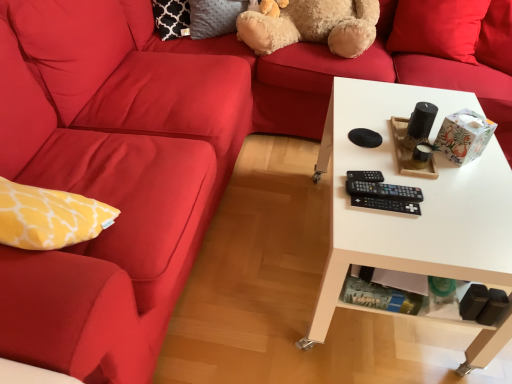
Where is `free space to the back side of black plastic remote at center, the first control from the back`? The height and width of the screenshot is (384, 512). free space to the back side of black plastic remote at center, the first control from the back is located at coordinates (364, 146).